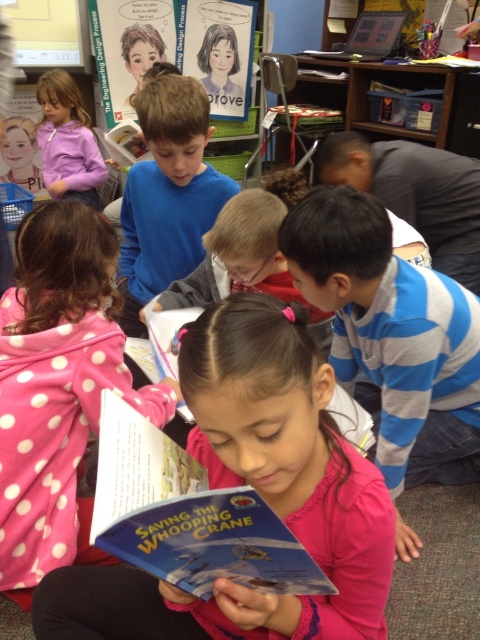
Where is `pink fabric book at center`? The image size is (480, 640). pink fabric book at center is located at coordinates (257, 492).

Can you confirm if pink fabric book at center is smaller than purple fleece jacket at upper left?

Actually, pink fabric book at center might be larger than purple fleece jacket at upper left.

Is point (360, 618) positioned in front of point (68, 138)?

Yes.

At what (x,y) coordinates should I click in order to perform the action: click on pink fabric book at center. Please return your answer as a coordinate pair (x, y). Looking at the image, I should click on (257, 492).

Is point (184, 138) closer to camera compared to point (43, 129)?

Yes, it is.

Which is below, blue cotton shirt at center or purple fleece jacket at upper left?

blue cotton shirt at center is lower down.

The image size is (480, 640). Identify the location of blue cotton shirt at center. (167, 193).

In the scene shown: Which of these two, pink polka dot hoodie at center or blue paper book at center, stands shorter?

blue paper book at center is shorter.

Does pink polka dot hoodie at center come in front of blue paper book at center?

That is False.

Is point (81, 301) farther from camera compared to point (164, 518)?

Yes, it is.

This screenshot has height=640, width=480. I want to click on pink polka dot hoodie at center, so click(58, 388).